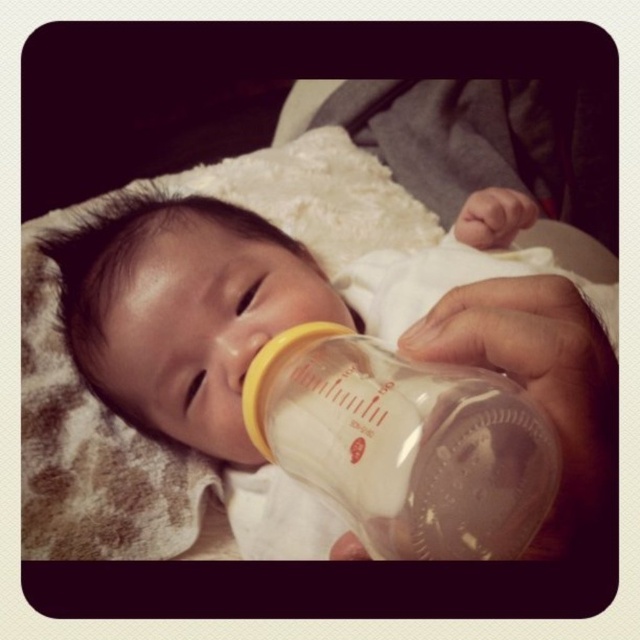
Question: Is transparent plastic bottle at center to the right of transparent plastic baby bottle at center from the viewer's perspective?

Choices:
 (A) no
 (B) yes

Answer: (B)

Question: Which object is farther from the camera taking this photo?

Choices:
 (A) transparent plastic bottle at center
 (B) transparent plastic baby bottle at center

Answer: (A)

Question: Is transparent plastic bottle at center wider than transparent plastic baby bottle at center?

Choices:
 (A) no
 (B) yes

Answer: (B)

Question: Which point is farther from the camera taking this photo?

Choices:
 (A) (400, 529)
 (B) (170, 200)

Answer: (B)

Question: Is transparent plastic bottle at center smaller than transparent plastic baby bottle at center?

Choices:
 (A) no
 (B) yes

Answer: (A)

Question: Which of the following is the closest to the observer?

Choices:
 (A) (492, 433)
 (B) (236, 381)

Answer: (A)